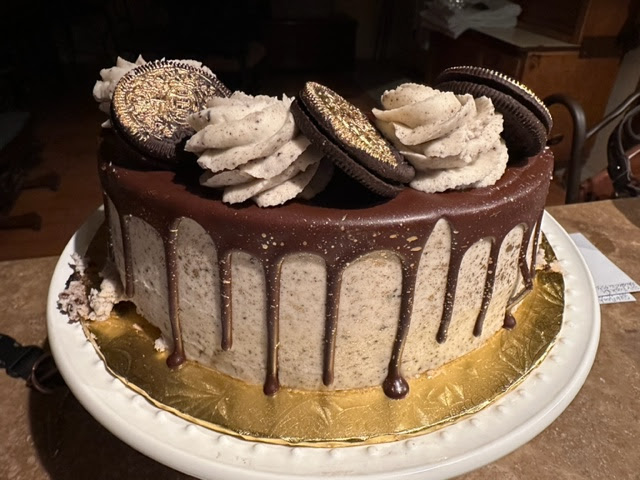
What are the coordinates of `towels` in the screenshot? It's located at (472, 18).